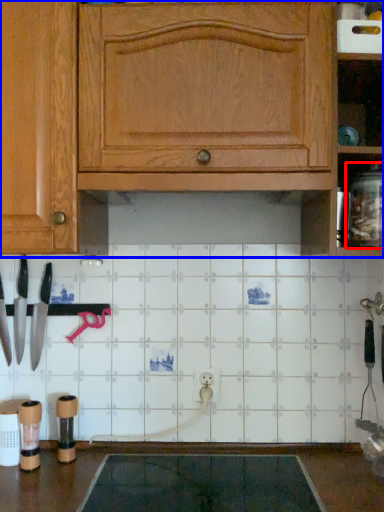
Question: Among these objects, which one is farthest to the camera, glass jar (highlighted by a red box) or cabinetry (highlighted by a blue box)?

Choices:
 (A) glass jar
 (B) cabinetry

Answer: (A)